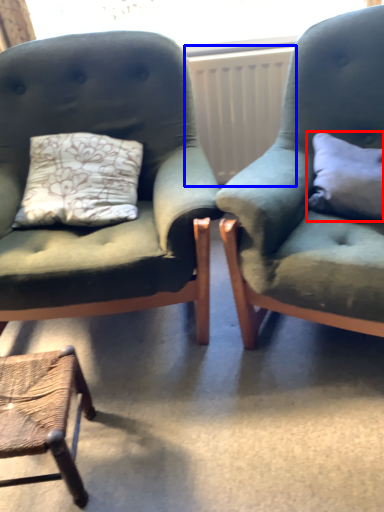
Question: Which object appears closest to the camera in this image, pillow (highlighted by a red box) or radiator (highlighted by a blue box)?

Choices:
 (A) pillow
 (B) radiator

Answer: (A)